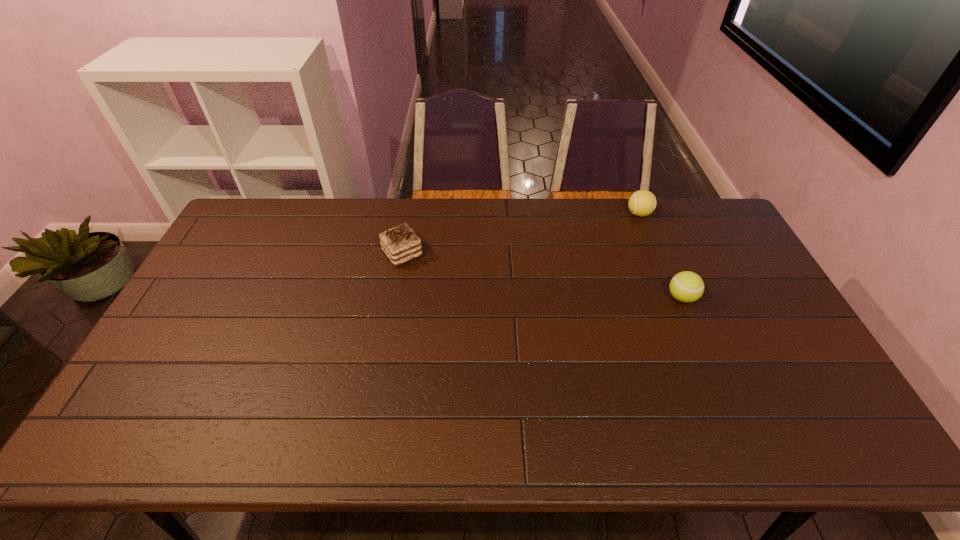
The width and height of the screenshot is (960, 540). Identify the location of vacant region at the near edge of the desktop. (419, 428).

In the image, there is a desktop. Where is `vacant space at the left edge`? Image resolution: width=960 pixels, height=540 pixels. vacant space at the left edge is located at coordinates (183, 349).

I want to click on free space at the right edge of the desktop, so click(764, 313).

Find the location of a particular element. The image size is (960, 540). blank space at the far right corner of the desktop is located at coordinates (684, 211).

Where is `vacant region at the near right corner`? The width and height of the screenshot is (960, 540). vacant region at the near right corner is located at coordinates (848, 428).

You are a GUI agent. You are given a task and a screenshot of the screen. Output one action in this format:
    pyautogui.click(x=<x>, y=<y>)
    Task: Click on the empty space between the nearer tennis ball and the farthest object
    This screenshot has width=960, height=540.
    Given the screenshot: What is the action you would take?
    pyautogui.click(x=660, y=256)

Locate an element on the screen. The width and height of the screenshot is (960, 540). vacant area between the nearer tennis ball and the second nearest object is located at coordinates (542, 276).

Locate an element on the screen. free spot between the farthest object and the nearest object is located at coordinates (660, 256).

Where is `vacant space in between the farther tennis ball and the leftmost object`? The height and width of the screenshot is (540, 960). vacant space in between the farther tennis ball and the leftmost object is located at coordinates (520, 234).

Where is `free space that is in between the nearer tennis ball and the leftmost object`? This screenshot has height=540, width=960. free space that is in between the nearer tennis ball and the leftmost object is located at coordinates (542, 276).